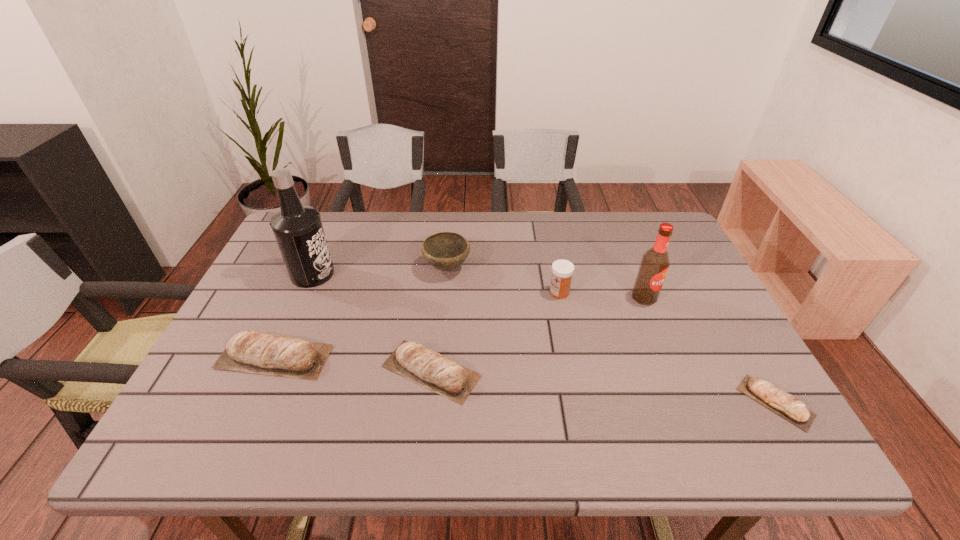
To achieve uniform spacing by inserting another pita_(bread) among them, please point to a free space for this new pita_(bread). Please provide its 2D coordinates. Your answer should be formatted as a tuple, i.e. [(x, y)], where the tuple contains the x and y coordinates of a point satisfying the conditions above.

[(598, 386)]